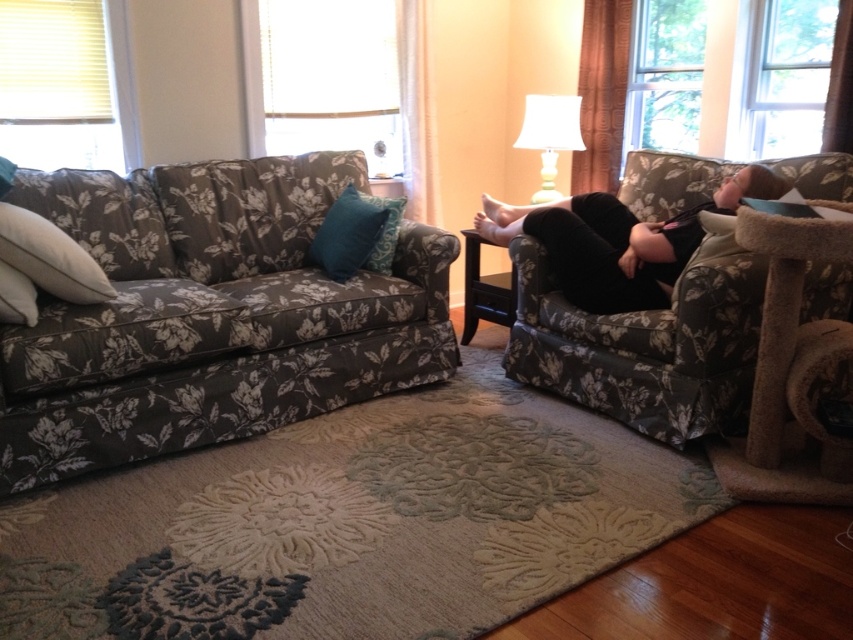
You are standing in the living room and want to place a small plant between the two points labeled point (404,342) and point (18,298). Which point should the plant be closer to if you want it to be nearer to the camera?

The plant should be closer to point (404,342) because it is further to the camera than point (18,298).